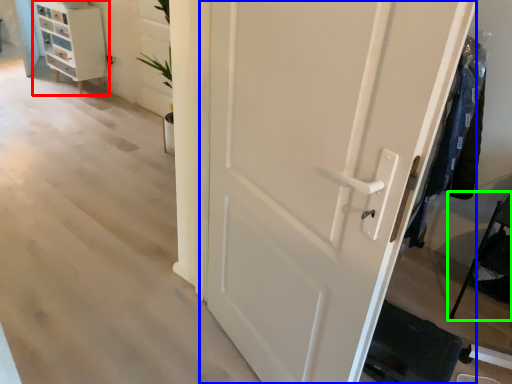
Question: Which is farther away from chest of drawers (highlighted by a red box)? door (highlighted by a blue box) or furniture (highlighted by a green box)?

Choices:
 (A) door
 (B) furniture

Answer: (B)